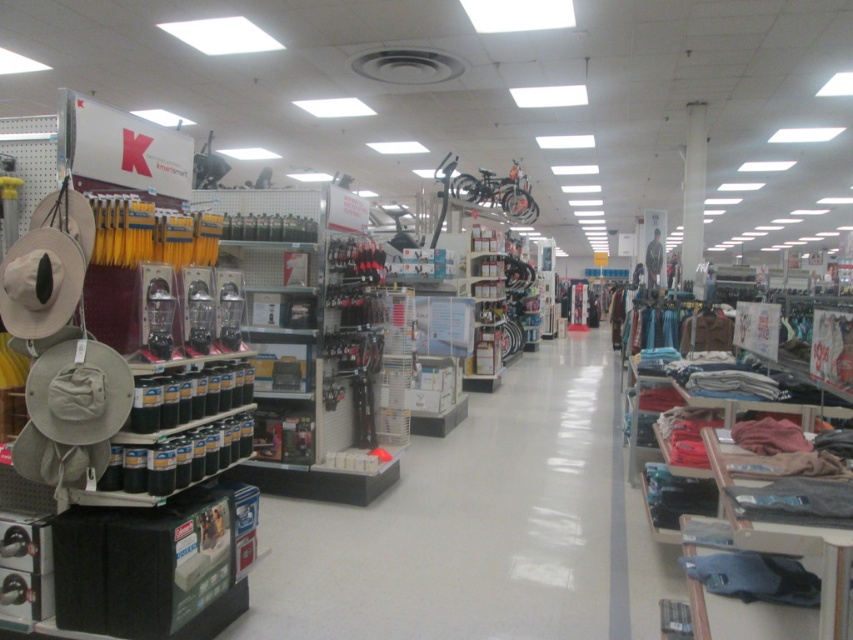
Which is more to the left, denim fabric pants at lower right or camouflage fabric shirt at center?

denim fabric pants at lower right

Is point (693, 451) positioned before point (653, 282)?

Yes, it is.

Measure the distance between denim fabric pants at lower right and camera.

A distance of 9.85 feet exists between denim fabric pants at lower right and camera.

This screenshot has width=853, height=640. Find the location of `denim fabric pants at lower right`. denim fabric pants at lower right is located at coordinates (729, 404).